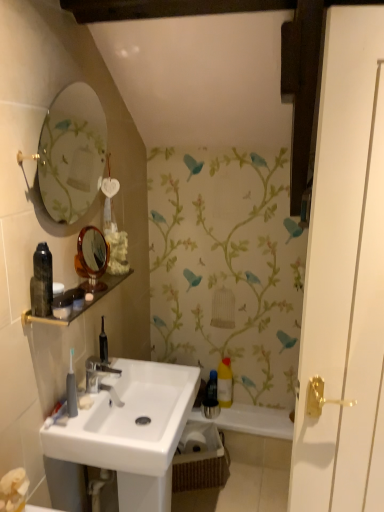
This screenshot has width=384, height=512. What do you see at coordinates (92, 257) in the screenshot?
I see `orange-brown wooden mirror at upper left` at bounding box center [92, 257].

Image resolution: width=384 pixels, height=512 pixels. Describe the element at coordinates (132, 431) in the screenshot. I see `white glossy sink at center` at that location.

Measure the distance between point (243, 421) and camera.

A distance of 2.29 meters exists between point (243, 421) and camera.

This screenshot has height=512, width=384. Describe the element at coordinates (83, 305) in the screenshot. I see `black glass shelf at upper left` at that location.

Where is `shiny black spray can at left, the 1th toiletry viewed from the top`? The image size is (384, 512). shiny black spray can at left, the 1th toiletry viewed from the top is located at coordinates (42, 281).

The width and height of the screenshot is (384, 512). I want to click on orange-brown wooden mirror at upper left, so (92, 257).

Who is smaller, orange-brown wooden mirror at upper left or woven brown basket at lower center?

orange-brown wooden mirror at upper left is smaller.

From the image's perspective, is orange-brown wooden mirror at upper left positioned above or below woven brown basket at lower center?

From the image's perspective, orange-brown wooden mirror at upper left appears above woven brown basket at lower center.

Is woven brown basket at lower center at the back of orange-brown wooden mirror at upper left?

orange-brown wooden mirror at upper left is not turned away from woven brown basket at lower center.

Where is `mirror located in front of the woven brown basket at lower center`? Image resolution: width=384 pixels, height=512 pixels. mirror located in front of the woven brown basket at lower center is located at coordinates (92, 257).

From the image's perspective, is black rubber toothbrush at lower left, the first toiletry positioned from the bottom, below silver metallic faucet at center?

Actually, black rubber toothbrush at lower left, the first toiletry positioned from the bottom, appears above silver metallic faucet at center in the image.

What's the angular difference between black rubber toothbrush at lower left, the 1th toiletry positioned from the back, and silver metallic faucet at center's facing directions?

They differ by 51.4 degrees in their facing directions.

Which is correct: black rubber toothbrush at lower left, the 3th toiletry in the top-to-bottom sequence, is inside silver metallic faucet at center, or outside of it?

black rubber toothbrush at lower left, the 3th toiletry in the top-to-bottom sequence, exists outside the volume of silver metallic faucet at center.

Considering the sizes of yellow plastic bottle at center and black rubber toothbrush at lower left, the 3th toiletry in the top-to-bottom sequence, in the image, is yellow plastic bottle at center wider or thinner than black rubber toothbrush at lower left, the 3th toiletry in the top-to-bottom sequence,?

Clearly, yellow plastic bottle at center has more width compared to black rubber toothbrush at lower left, the 3th toiletry in the top-to-bottom sequence.

Looking at this image, is yellow plastic bottle at center bigger than black rubber toothbrush at lower left, the 3th toiletry viewed from the front?

Correct, yellow plastic bottle at center is larger in size than black rubber toothbrush at lower left, the 3th toiletry viewed from the front.

The width and height of the screenshot is (384, 512). What are the coordinates of `bottle that appears below the black rubber toothbrush at lower left, the 3th toiletry in the top-to-bottom sequence (from a real-world perspective)` in the screenshot? It's located at (225, 383).

Visually, is silver metallic faucet at center positioned to the left or to the right of yellow plastic bottle at center?

Result: silver metallic faucet at center is positioned on yellow plastic bottle at center's left side.

Is silver metallic faucet at center surrounding yellow plastic bottle at center?

No, yellow plastic bottle at center is not inside silver metallic faucet at center.

Between silver metallic faucet at center and yellow plastic bottle at center, which one has more height?

yellow plastic bottle at center is taller.

Between shiny black spray can at left, acting as the 3th toiletry starting from the back, and white glossy sink at center, which one has larger size?

white glossy sink at center is bigger.

From the image's perspective, relative to white glossy sink at center, is shiny black spray can at left, arranged as the first toiletry when viewed from the front, above or below?

shiny black spray can at left, arranged as the first toiletry when viewed from the front, is situated higher than white glossy sink at center in the image.

From a real-world perspective, who is located higher, shiny black spray can at left, the 1th toiletry viewed from the top, or white glossy sink at center?

From a 3D spatial view, shiny black spray can at left, the 1th toiletry viewed from the top, is above.

From their relative heights in the image, would you say shiny black spray can at left, arranged as the first toiletry when viewed from the front, is taller or shorter than white glossy sink at center?

Considering their sizes, shiny black spray can at left, arranged as the first toiletry when viewed from the front, has less height than white glossy sink at center.

Does point (329, 426) come behind point (112, 390)?

No.

Which is behind, white glossy door at right or silver metallic faucet at center?

silver metallic faucet at center is more distant.

Which object is positioned more to the left, white glossy door at right or silver metallic faucet at center?

silver metallic faucet at center is more to the left.

What's the angular difference between white glossy door at right and silver metallic faucet at center's facing directions?

The angle between the facing direction of white glossy door at right and the facing direction of silver metallic faucet at center is 77.3 degrees.

Is black glass shelf at upper left at the back of matte black container at upper left, which is counted as the 2th toiletry, starting from the front?

No, matte black container at upper left, which is counted as the 2th toiletry, starting from the front, is not facing the opposite direction of black glass shelf at upper left.

From a real-world perspective, who is located higher, matte black container at upper left, which is counted as the 2th toiletry, starting from the front, or black glass shelf at upper left?

matte black container at upper left, which is counted as the 2th toiletry, starting from the front, from a real-world perspective.

Can you confirm if matte black container at upper left, arranged as the second toiletry when viewed from the top, is thinner than black glass shelf at upper left?

Yes, matte black container at upper left, arranged as the second toiletry when viewed from the top, is thinner than black glass shelf at upper left.

Between matte black container at upper left, which is the 2th toiletry from bottom to top, and black glass shelf at upper left, which one appears on the right side from the viewer's perspective?

Positioned to the right is black glass shelf at upper left.

This screenshot has width=384, height=512. I want to click on basket located below the orange-brown wooden mirror at upper left (from the image's perspective), so click(200, 459).

Find the location of a particular element. This screenshot has height=512, width=384. tap beneath the black rubber toothbrush at lower left, the 1th toiletry positioned from the back (from a real-world perspective) is located at coordinates (101, 377).

Which object lies nearer to the anchor point shiny black spray can at left, acting as the 3th toiletry starting from the back, white glossy door at right or matte black container at upper left, which is the 2th toiletry from bottom to top?

matte black container at upper left, which is the 2th toiletry from bottom to top.

Looking at the image, which one is located closer to white glossy bath at lower right, yellow plastic bottle at center or white glossy sink at center?

yellow plastic bottle at center.

Considering their positions, is orange-brown wooden mirror at upper left positioned closer to white glossy door at right than yellow plastic bottle at center?

orange-brown wooden mirror at upper left.

From the image, which object appears to be farther from yellow plastic bottle at center, black rubber toothbrush at lower left, the 3th toiletry viewed from the front, or silver metallic faucet at center?

The object further to yellow plastic bottle at center is black rubber toothbrush at lower left, the 3th toiletry viewed from the front.

When comparing their distances from shiny black spray can at left, acting as the 3th toiletry starting from the back, does matte black container at upper left, which is the 2th toiletry from bottom to top, or silver metallic faucet at center seem closer?

Based on the image, matte black container at upper left, which is the 2th toiletry from bottom to top, appears to be nearer to shiny black spray can at left, acting as the 3th toiletry starting from the back.

Based on their spatial positions, is white glossy bath at lower right or shiny black spray can at left, acting as the 3th toiletry starting from the back, closer to black rubber toothbrush at lower left, the 3th toiletry in the top-to-bottom sequence?

shiny black spray can at left, acting as the 3th toiletry starting from the back, is closer to black rubber toothbrush at lower left, the 3th toiletry in the top-to-bottom sequence.

Based on their spatial positions, is matte black container at upper left, which is counted as the second toiletry, starting from the back, or silver metallic faucet at center further from white glossy bath at lower right?

matte black container at upper left, which is counted as the second toiletry, starting from the back, lies further to white glossy bath at lower right than the other object.

Consider the image. When comparing their distances from black rubber toothbrush at lower left, the 1th toiletry positioned from the back, does woven brown basket at lower center or matte black container at upper left, which is the 2th toiletry from bottom to top, seem closer?

matte black container at upper left, which is the 2th toiletry from bottom to top, lies closer to black rubber toothbrush at lower left, the 1th toiletry positioned from the back, than the other object.

Find the location of a particular element. toiletry between black rubber toothbrush at lower left, the 3th toiletry in the top-to-bottom sequence, and white glossy door at right from left to right is located at coordinates (68, 303).

This screenshot has width=384, height=512. Identify the location of sink that lies between black glass shelf at upper left and woven brown basket at lower center from top to bottom. (132, 431).

The width and height of the screenshot is (384, 512). In order to click on balustrade that lies between shiny black spray can at left, the 1th toiletry viewed from the top, and black rubber toothbrush at lower left, the first toiletry positioned from the bottom, from top to bottom in this screenshot , I will do `click(83, 305)`.

Find the location of a particular element. tap positioned between white glossy sink at center and woven brown basket at lower center from near to far is located at coordinates (101, 377).